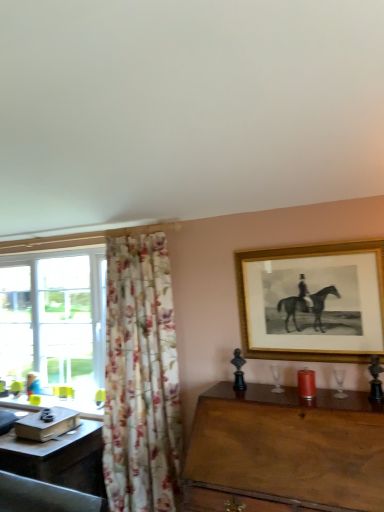
At what (x,y) coordinates should I click in order to perform the action: click on blank space situated above gold framed print at upper right (from a real-world perspective). Please return your answer as a coordinate pair (x, y). Image resolution: width=384 pixels, height=512 pixels. Looking at the image, I should click on (301, 243).